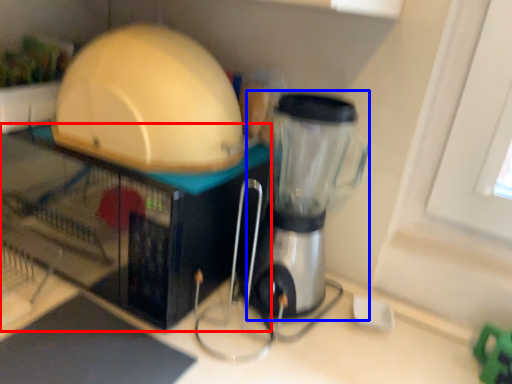
Question: Among these objects, which one is nearest to the camera, appliance (highlighted by a red box) or blender (highlighted by a blue box)?

Choices:
 (A) appliance
 (B) blender

Answer: (B)